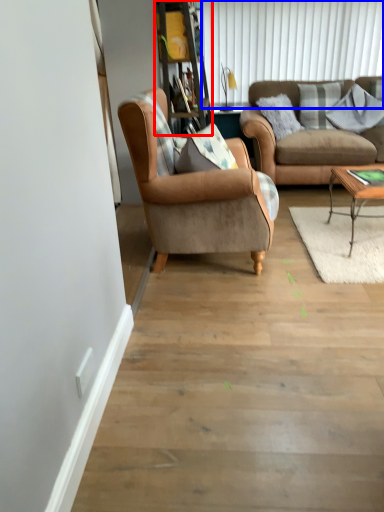
Question: Which of the following is the closest to the observer, bookshelf (highlighted by a red box) or shutter (highlighted by a blue box)?

Choices:
 (A) bookshelf
 (B) shutter

Answer: (A)